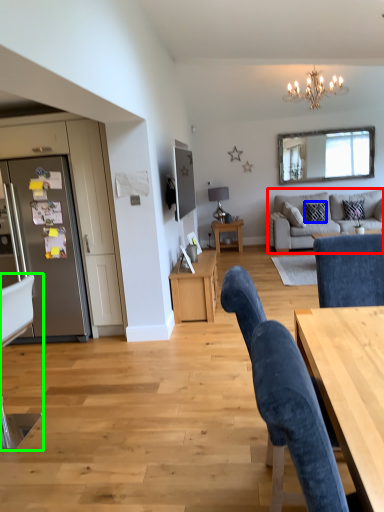
Question: Which is nearer to the studio couch (highlighted by a red box)? pillow (highlighted by a blue box) or chair (highlighted by a green box).

Choices:
 (A) pillow
 (B) chair

Answer: (A)